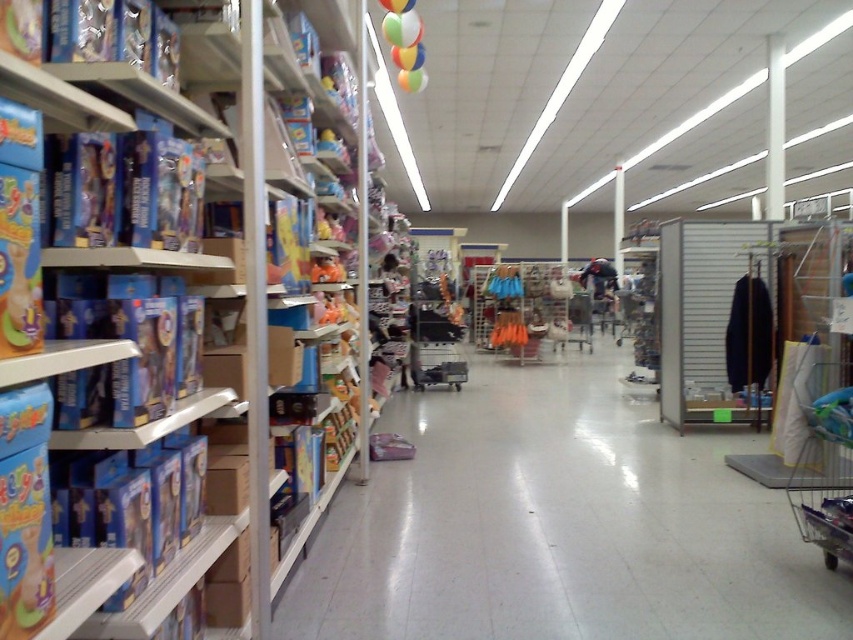
Does metallic silver shopping cart at lower right have a greater width compared to metallic silver shopping cart at center?

Correct, the width of metallic silver shopping cart at lower right exceeds that of metallic silver shopping cart at center.

Is metallic silver shopping cart at lower right thinner than metallic silver shopping cart at center?

No, metallic silver shopping cart at lower right is not thinner than metallic silver shopping cart at center.

Measure the distance between point [836,563] and camera.

The distance of point [836,563] from camera is 3.29 meters.

The height and width of the screenshot is (640, 853). In order to click on metallic silver shopping cart at lower right in this screenshot , I will do `click(822, 454)`.

Does blue cardboard boxes at left have a lesser width compared to metallic silver shopping cart at lower right?

Correct, blue cardboard boxes at left's width is less than metallic silver shopping cart at lower right's.

Does blue cardboard boxes at left appear on the right side of metallic silver shopping cart at lower right?

In fact, blue cardboard boxes at left is to the left of metallic silver shopping cart at lower right.

Does point (163, 378) come closer to viewer compared to point (840, 536)?

Yes, it is.

This screenshot has height=640, width=853. In order to click on blue cardboard boxes at left in this screenshot , I will do (143, 273).

Does white glossy floor at center have a greater height compared to metallic silver shopping cart at center?

Incorrect, white glossy floor at center's height is not larger of metallic silver shopping cart at center's.

Between point (746, 435) and point (456, 349), which one is positioned behind?

The point (456, 349) is more distant.

Which is in front, point (693, 557) or point (428, 362)?

Point (693, 557)

The height and width of the screenshot is (640, 853). Find the location of `white glossy floor at center`. white glossy floor at center is located at coordinates [560, 524].